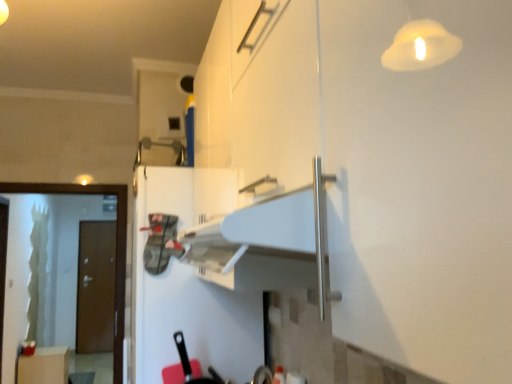
Measure the distance between point (91, 246) and camera.

They are 5.90 meters apart.

Locate an element on the screen. green frosted glass screen door at left is located at coordinates (116, 243).

This screenshot has width=512, height=384. What do you see at coordinates (116, 243) in the screenshot?
I see `green frosted glass screen door at left` at bounding box center [116, 243].

What do you see at coordinates (44, 366) in the screenshot?
I see `matte white cabinet at lower left` at bounding box center [44, 366].

Identify the location of brown matte door at left. This screenshot has width=512, height=384. (96, 287).

Based on the photo, is matte white cabinet at lower left aimed at brown matte door at left?

No, matte white cabinet at lower left is not turned towards brown matte door at left.

Is point (54, 382) less distant than point (104, 333)?

Yes.

Where is `cabinetry in front of the brown matte door at left`? cabinetry in front of the brown matte door at left is located at coordinates (44, 366).

Measure the distance between matte white cabinet at lower left and brown matte door at left.

matte white cabinet at lower left is 1.31 meters from brown matte door at left.

Is white matte refrigerator at center located within green frosted glass screen door at left?

No, white matte refrigerator at center is not a part of green frosted glass screen door at left.

Does green frosted glass screen door at left come in front of white matte refrigerator at center?

No, green frosted glass screen door at left is behind white matte refrigerator at center.

Is white matte refrigerator at center at the back of green frosted glass screen door at left?

No, white matte refrigerator at center is not at the back of green frosted glass screen door at left.

Does green frosted glass screen door at left have a lesser width compared to white matte refrigerator at center?

Correct, the width of green frosted glass screen door at left is less than that of white matte refrigerator at center.

In the image, there is a matte white cabinet at lower left. Where is `door above it (from the image's perspective)`? door above it (from the image's perspective) is located at coordinates (96, 287).

Considering the positions of objects brown matte door at left and matte white cabinet at lower left in the image provided, who is more to the left, brown matte door at left or matte white cabinet at lower left?

Positioned to the left is brown matte door at left.

Does brown matte door at left turn towards matte white cabinet at lower left?

Yes, brown matte door at left faces towards matte white cabinet at lower left.

Is brown matte door at left behind green frosted glass screen door at left?

Yes, brown matte door at left is behind green frosted glass screen door at left.

Is brown matte door at left next to green frosted glass screen door at left?

No, brown matte door at left is not making contact with green frosted glass screen door at left.

Is brown matte door at left spatially inside green frosted glass screen door at left, or outside of it?

The correct answer is: outside.

Is green frosted glass screen door at left bigger or smaller than brown matte door at left?

green frosted glass screen door at left is bigger than brown matte door at left.

Is green frosted glass screen door at left aimed at brown matte door at left?

No, green frosted glass screen door at left is not facing towards brown matte door at left.

Locate an element on the screen. The image size is (512, 384). screen door that is in front of the brown matte door at left is located at coordinates (116, 243).

What's the angular difference between green frosted glass screen door at left and brown matte door at left's facing directions?

There is a 0.00205-degree angle between the facing directions of green frosted glass screen door at left and brown matte door at left.

Is matte white cabinet at lower left surrounded by green frosted glass screen door at left?

No, matte white cabinet at lower left is not a part of green frosted glass screen door at left.

Is green frosted glass screen door at left next to matte white cabinet at lower left?

They are not placed beside each other.

Does green frosted glass screen door at left come in front of matte white cabinet at lower left?

Yes, the depth of green frosted glass screen door at left is less than that of matte white cabinet at lower left.

Which object is thinner, green frosted glass screen door at left or matte white cabinet at lower left?

green frosted glass screen door at left is thinner.

Based on the photo, can you tell me how much white matte refrigerator at center and green frosted glass screen door at left differ in facing direction?

There is a 89.6-degree angle between the facing directions of white matte refrigerator at center and green frosted glass screen door at left.

Is green frosted glass screen door at left inside white matte refrigerator at center?

That's incorrect, green frosted glass screen door at left is not inside white matte refrigerator at center.

From a real-world perspective, is white matte refrigerator at center physically below green frosted glass screen door at left?

No, from a real-world perspective, white matte refrigerator at center is not under green frosted glass screen door at left.

The width and height of the screenshot is (512, 384). I want to click on fridge above the green frosted glass screen door at left (from the image's perspective), so click(x=188, y=288).

This screenshot has height=384, width=512. What are the coordinates of `door above the matte white cabinet at lower left (from the image's perspective)` in the screenshot? It's located at (96, 287).

Find the location of a particular element. Image resolution: width=512 pixels, height=384 pixels. fridge on the right of green frosted glass screen door at left is located at coordinates (188, 288).

Estimate the real-world distances between objects in this image. Which object is further from matte white cabinet at lower left, green frosted glass screen door at left or brown matte door at left?

green frosted glass screen door at left is further to matte white cabinet at lower left.

When comparing their distances from green frosted glass screen door at left, does brown matte door at left or matte white cabinet at lower left seem further?

brown matte door at left.

Estimate the real-world distances between objects in this image. Which object is further from matte white cabinet at lower left, brown matte door at left or green frosted glass screen door at left?

Among the two, green frosted glass screen door at left is located further to matte white cabinet at lower left.

In the scene shown: Considering their positions, is matte white cabinet at lower left positioned further to white matte refrigerator at center than brown matte door at left?

brown matte door at left lies further to white matte refrigerator at center than the other object.

Looking at the image, which one is located closer to brown matte door at left, matte white cabinet at lower left or green frosted glass screen door at left?

matte white cabinet at lower left is closer to brown matte door at left.

Looking at the image, which one is located closer to matte white cabinet at lower left, brown matte door at left or white matte refrigerator at center?

brown matte door at left.

Based on their spatial positions, is brown matte door at left or white matte refrigerator at center further from green frosted glass screen door at left?

brown matte door at left.

When comparing their distances from matte white cabinet at lower left, does white matte refrigerator at center or brown matte door at left seem further?

white matte refrigerator at center is positioned further to the anchor matte white cabinet at lower left.

You are a GUI agent. You are given a task and a screenshot of the screen. Output one action in this format:
    pyautogui.click(x=<x>, y=<y>)
    Task: Click on the cabinetry between white matte refrigerator at center and brown matte door at left in the front-back direction
    
    Given the screenshot: What is the action you would take?
    pyautogui.click(x=44, y=366)

Image resolution: width=512 pixels, height=384 pixels. I want to click on screen door between white matte refrigerator at center and brown matte door at left along the z-axis, so click(x=116, y=243).

The height and width of the screenshot is (384, 512). Identify the location of cabinetry between green frosted glass screen door at left and brown matte door at left along the z-axis. (44, 366).

Image resolution: width=512 pixels, height=384 pixels. Identify the location of screen door between white matte refrigerator at center and matte white cabinet at lower left along the z-axis. (116, 243).